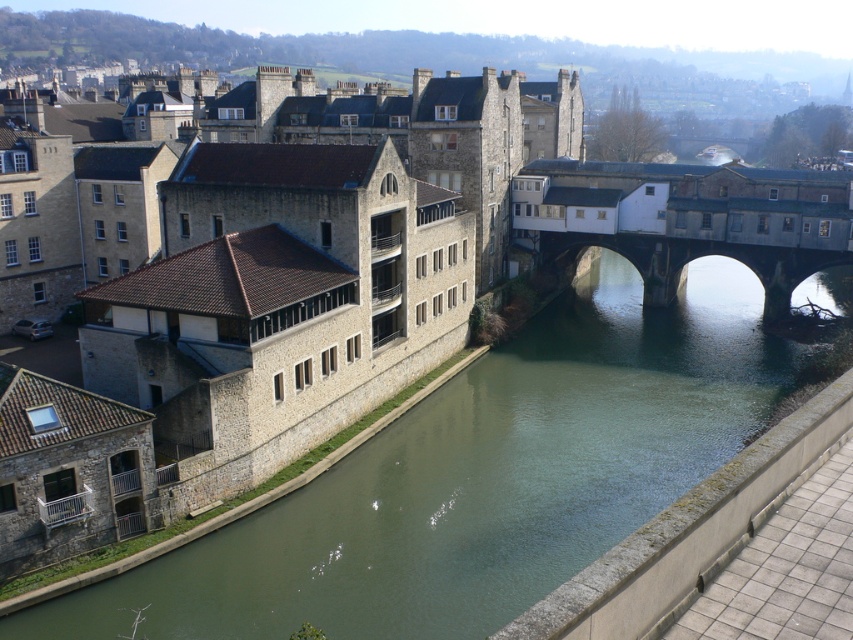
You are a tourist standing on the riverbank looking towards the historic town. You see the stone building at center and the stone arch bridge at center. Which one is positioned to the left from your viewpoint?

The stone building at center is positioned to the left of the stone arch bridge at center from your viewpoint.

You are a tourist standing on the stone arch bridge at center in the historic town. You want to take a photo of the green stone river at center. Which direction should you look to capture the river in your photo?

The green stone river at center is below the stone arch bridge at center, so you should look downward to capture the river in your photo.